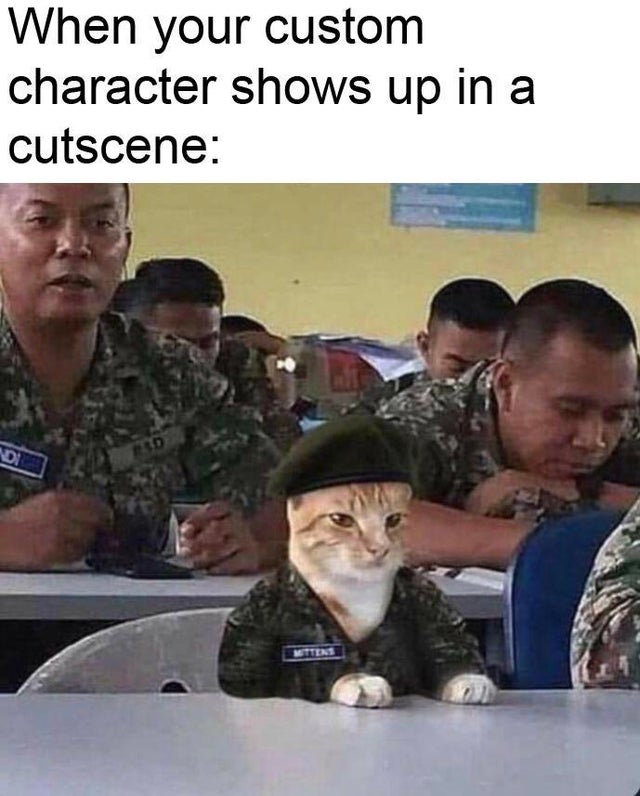
At what (x,y) coordinates should I click in order to perform the action: click on pick up the chair here. Please return your answer as a coordinate pair (x, y). This screenshot has width=640, height=796. Looking at the image, I should click on (132, 630).